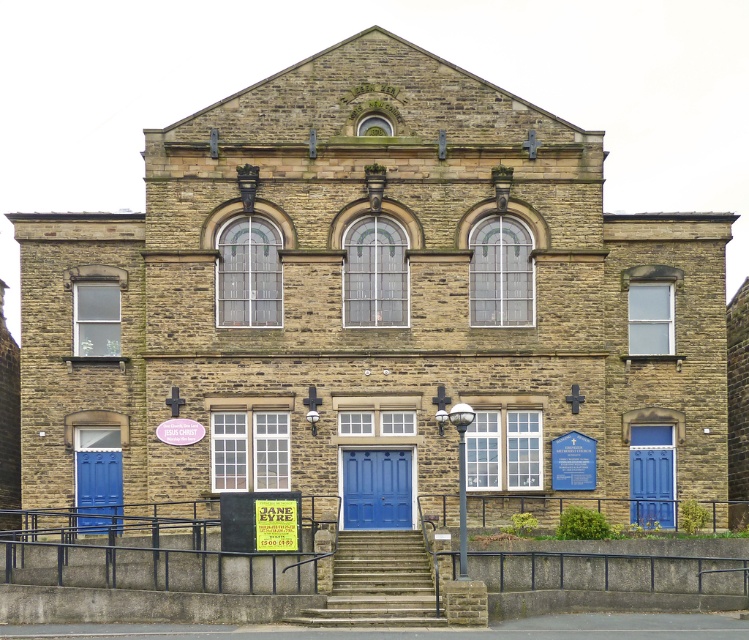
You are a painter hired to paint the doors of the building. You have a limited amount of paint. Which door, the blue wooden door at lower left or the blue wooden door at right, requires less paint?

The blue wooden door at lower left requires less paint because it has a smaller size compared to the blue wooden door at right.

You are standing in front of the building and see two points marked on the facade. According to their positions, which point is closer to you, point (x=421, y=536) or point (x=401, y=451)?

Point (x=421, y=536) is in front of point (x=401, y=451), so it is closer to you.